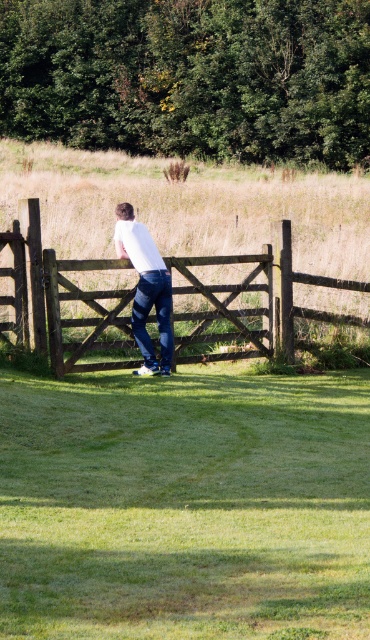
Who is taller, green grass at center or white matte shirt at center?

white matte shirt at center

Is green grass at center to the right of white matte shirt at center from the viewer's perspective?

Incorrect, green grass at center is not on the right side of white matte shirt at center.

Does point (65, 532) come farther from viewer compared to point (159, 264)?

No.

The height and width of the screenshot is (640, 370). I want to click on green grass at center, so click(185, 506).

Measure the distance between green grass at center and camera.

They are 23.47 feet apart.

The image size is (370, 640). Describe the element at coordinates (185, 506) in the screenshot. I see `green grass at center` at that location.

Is point (204, 476) farther from viewer compared to point (45, 307)?

That is False.

Find the location of `green grass at center`. green grass at center is located at coordinates (185, 506).

Who is lower down, wooden gate at center or white matte shirt at center?

wooden gate at center

Can you confirm if wooden gate at center is taller than white matte shirt at center?

No.

Where is `wooden gate at center`? The image size is (370, 640). wooden gate at center is located at coordinates (59, 300).